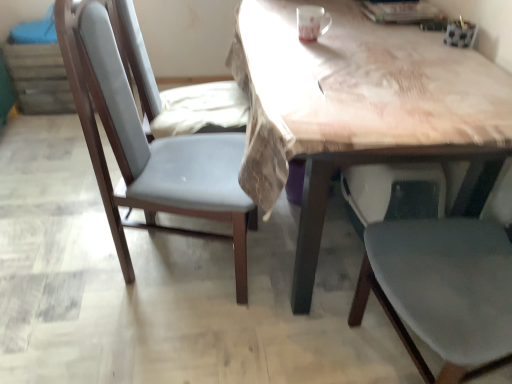
In order to click on matte gray chair at center in this screenshot , I will do `click(144, 134)`.

Describe the element at coordinates (144, 134) in the screenshot. This screenshot has height=384, width=512. I see `matte gray chair at center` at that location.

In order to face matte gray chair at center, should I rotate leftwards or rightwards?

Rotate left and turn 9.437 degrees.

What do you see at coordinates (355, 106) in the screenshot? Image resolution: width=512 pixels, height=384 pixels. I see `wooden table at center` at bounding box center [355, 106].

Where is `wooden table at center`? This screenshot has width=512, height=384. wooden table at center is located at coordinates (355, 106).

The height and width of the screenshot is (384, 512). I want to click on matte gray chair at center, so click(144, 134).

Would you say matte gray chair at center is to the left or to the right of wooden table at center in the picture?

matte gray chair at center is positioned on wooden table at center's left side.

Is matte gray chair at center in front of or behind wooden table at center in the image?

Visually, matte gray chair at center is located behind wooden table at center.

Which is further, (153, 100) or (284, 60)?

The point (153, 100) is farther from the camera.

From the image's perspective, which one is positioned higher, matte gray chair at center or wooden table at center?

wooden table at center is shown above in the image.

From a real-world perspective, who is located lower, matte gray chair at center or wooden table at center?

From a 3D spatial view, matte gray chair at center is below.

Looking at this image, between matte gray chair at center and wooden table at center, which one has smaller width?

matte gray chair at center.

Can you confirm if matte gray chair at center is shorter than wooden table at center?

No.

Between matte gray chair at center and wooden table at center, which one has smaller size?

matte gray chair at center.

Is matte gray chair at center inside or outside of wooden table at center?

matte gray chair at center is outside wooden table at center.

Would you consider matte gray chair at center to be distant from wooden table at center?

No, matte gray chair at center is not far from wooden table at center.

Does matte gray chair at center turn towards wooden table at center?

→ Yes, matte gray chair at center is facing wooden table at center.

What's the angular difference between matte gray chair at center and wooden table at center's facing directions?

There is a 169-degree angle between the facing directions of matte gray chair at center and wooden table at center.

Measure the distance between matte gray chair at center and wooden table at center.

16.35 inches.

Identify the location of chair on the left of wooden table at center. This screenshot has height=384, width=512. (144, 134).

Between wooden table at center and matte gray chair at center, which one appears on the left side from the viewer's perspective?

matte gray chair at center is more to the left.

Relative to matte gray chair at center, is wooden table at center in front or behind?

wooden table at center is in front of matte gray chair at center.

Which is nearer, [337,161] or [170,155]?

Point [337,161] appears to be closer to the viewer than point [170,155].

From the image's perspective, who appears lower, wooden table at center or matte gray chair at center?

matte gray chair at center appears lower in the image.

From a real-world perspective, is wooden table at center positioned above or below matte gray chair at center?

wooden table at center is situated higher than matte gray chair at center in the real world.

Which of these two, wooden table at center or matte gray chair at center, is thinner?

With smaller width is matte gray chair at center.

Does wooden table at center have a lesser height compared to matte gray chair at center?

Correct, wooden table at center is not as tall as matte gray chair at center.

Which of these two, wooden table at center or matte gray chair at center, is smaller?

matte gray chair at center is smaller.

Is wooden table at center not within matte gray chair at center?

wooden table at center lies outside matte gray chair at center's area.

Is wooden table at center far away from matte gray chair at center?

They are positioned close to each other.

Is wooden table at center looking in the opposite direction of matte gray chair at center?

No, wooden table at center is not facing the opposite direction of matte gray chair at center.

How different are the orientations of wooden table at center and matte gray chair at center in degrees?

The angular difference between wooden table at center and matte gray chair at center is 169 degrees.

How far apart are wooden table at center and matte gray chair at center?

wooden table at center is 16.35 inches from matte gray chair at center.

Where is `chair that is below the wooden table at center (from the image's perspective)`? Image resolution: width=512 pixels, height=384 pixels. chair that is below the wooden table at center (from the image's perspective) is located at coordinates (144, 134).

Locate an element on the screen. table on the right of matte gray chair at center is located at coordinates (355, 106).

Image resolution: width=512 pixels, height=384 pixels. Find the location of `table above the matte gray chair at center (from a real-world perspective)`. table above the matte gray chair at center (from a real-world perspective) is located at coordinates (355, 106).